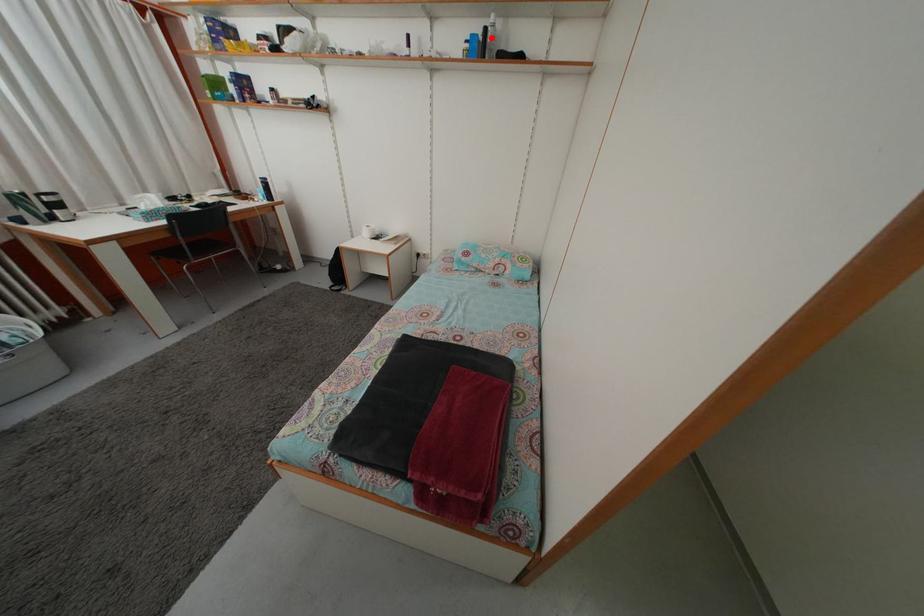
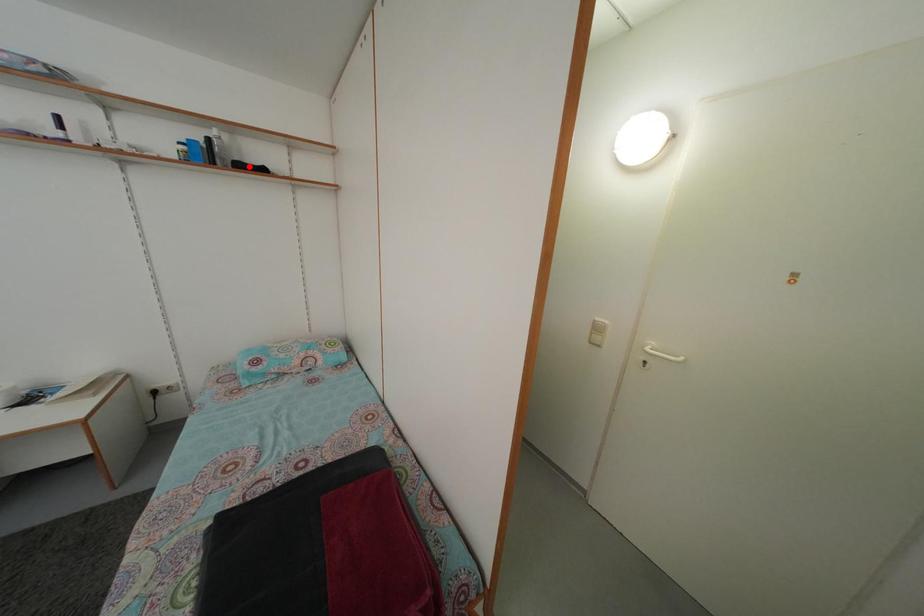
I am providing you with two images of the same scene from different viewpoints. A red point is marked on the first image and another point is marked on the second image. Do the highlighted points in image1 and image2 indicate the same real-world spot?

No